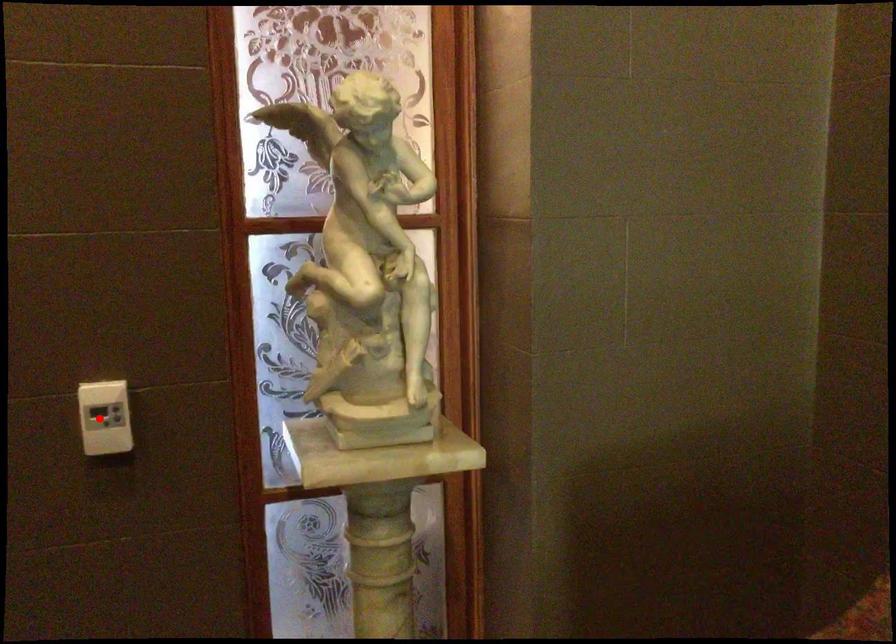
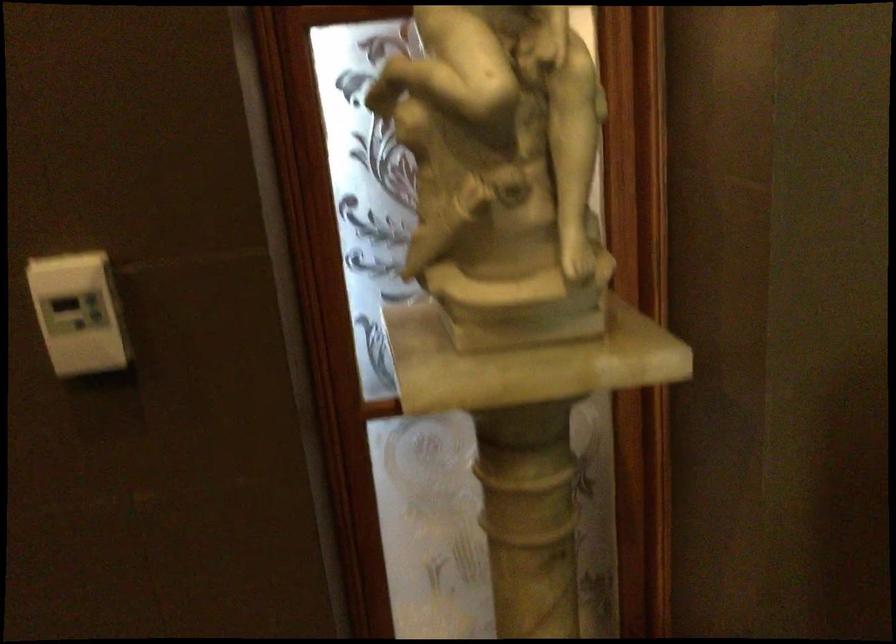
Question: A red point is marked in image1. In image2, is the corresponding 3D point closer to the camera or farther? Reply with the corresponding letter.

Choices:
 (A) The corresponding 3D point is closer.
 (B) The corresponding 3D point is farther.

Answer: (A)